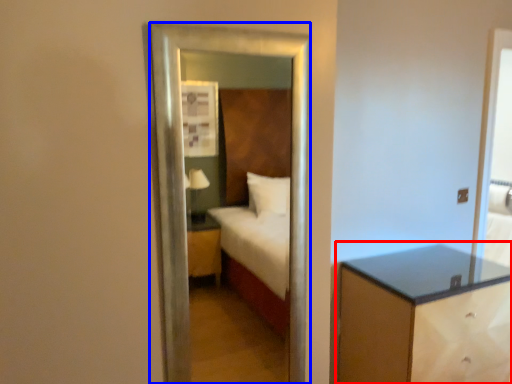
Question: Among these objects, which one is nearest to the camera, nightstand (highlighted by a red box) or mirror (highlighted by a blue box)?

Choices:
 (A) nightstand
 (B) mirror

Answer: (B)